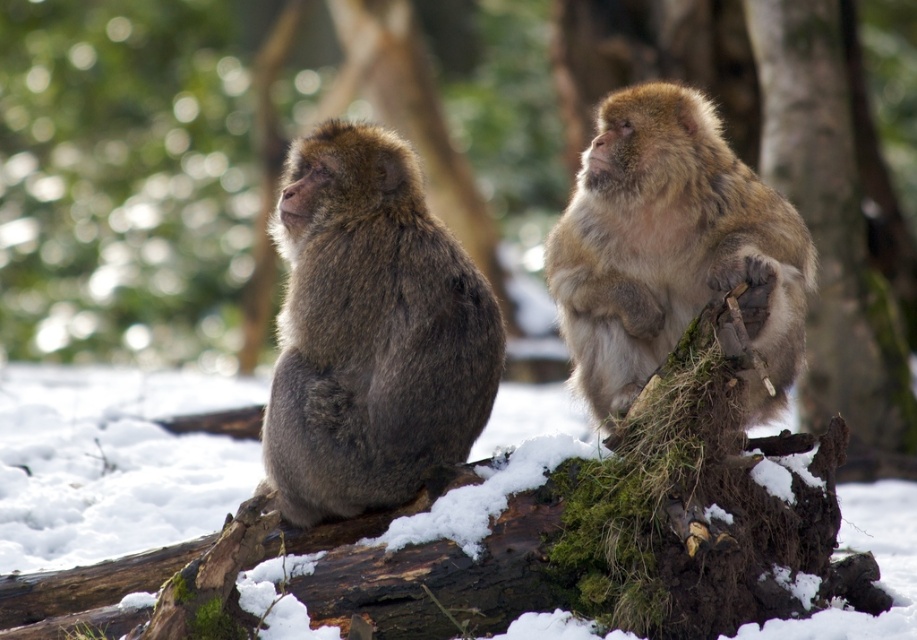
Question: Is brown furry monkey at left thinner than brown furry monkey at upper right?

Choices:
 (A) yes
 (B) no

Answer: (A)

Question: Which point is closer to the camera taking this photo?

Choices:
 (A) (356, 205)
 (B) (815, 634)

Answer: (B)

Question: Which object is closer to the camera taking this photo?

Choices:
 (A) brown furry monkey at upper right
 (B) white fluffy snow at center

Answer: (B)

Question: Is white fluffy snow at center further to the viewer compared to brown furry monkey at upper right?

Choices:
 (A) no
 (B) yes

Answer: (A)

Question: Is brown furry monkey at left to the left of brown furry monkey at upper right from the viewer's perspective?

Choices:
 (A) yes
 (B) no

Answer: (A)

Question: Which point appears farthest from the camera in this image?

Choices:
 (A) (472, 346)
 (B) (810, 250)

Answer: (B)